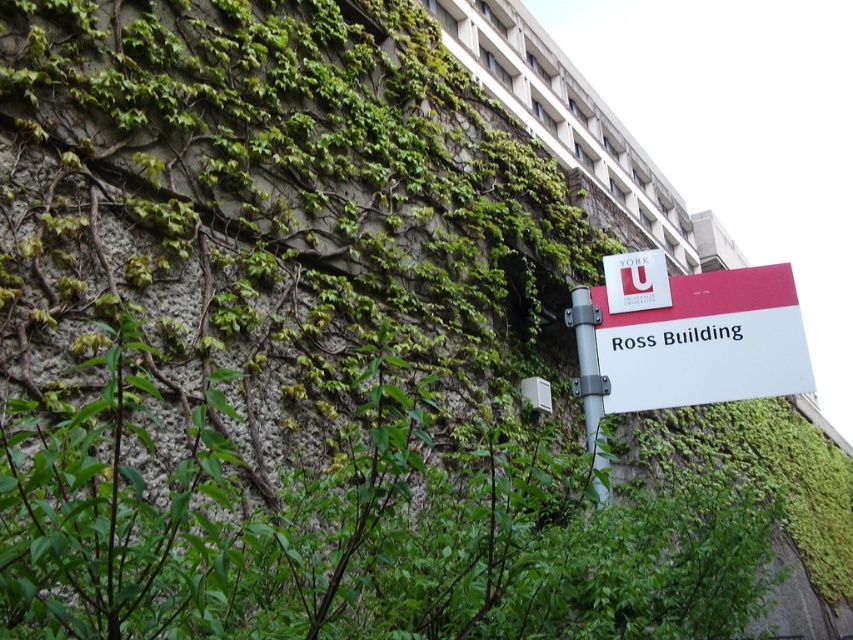
You are standing in front of the building and notice two points marked on the wall. The first point is at coordinates point (642, 396) and the second is at point (567, 312). Which point is closer to your eyes?

Point (642, 396) is closer to the camera than point (567, 312), so the first point is closer to your eyes.

You are standing in front of the building and notice the white plastic sign at lower right and the matte red sign at center. Which sign is closer to you?

The white plastic sign at lower right is closer to you because it is in front of the matte red sign at center.

You are standing in front of the Ross Building and want to read the white plastic sign at lower right. However, there is a silver metallic pole at upper center blocking your view. Can you move the sign to the side so you can see it better?

The white plastic sign at lower right is located above the silver metallic pole at upper center, so moving it might not be necessary as it is already positioned above the pole, which may provide a clear view.